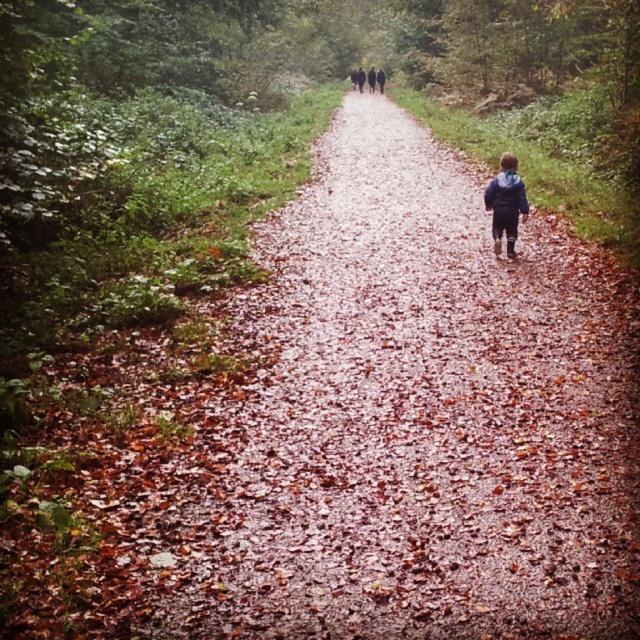
Is point (476, 193) farther from viewer compared to point (371, 83)?

No, it is not.

Image resolution: width=640 pixels, height=640 pixels. In order to click on brown leafy gravel path at center in this screenshot , I will do `click(410, 422)`.

Find the location of a particular element. The width and height of the screenshot is (640, 640). brown leafy gravel path at center is located at coordinates (410, 422).

Does brown leafy gravel path at center come in front of blue fabric jacket at center?

Yes, it is.

Is brown leafy gravel path at center further to camera compared to blue fabric jacket at center?

No, brown leafy gravel path at center is closer to the viewer.

Identify the location of brown leafy gravel path at center. Image resolution: width=640 pixels, height=640 pixels. (410, 422).

Where is `brown leafy gravel path at center`? This screenshot has width=640, height=640. brown leafy gravel path at center is located at coordinates tap(410, 422).

The height and width of the screenshot is (640, 640). What do you see at coordinates (506, 204) in the screenshot? I see `blue fabric jacket at center` at bounding box center [506, 204].

Which is in front, point (497, 252) or point (362, 70)?

Point (497, 252) is in front.

Image resolution: width=640 pixels, height=640 pixels. Identify the location of blue fabric jacket at center. (506, 204).